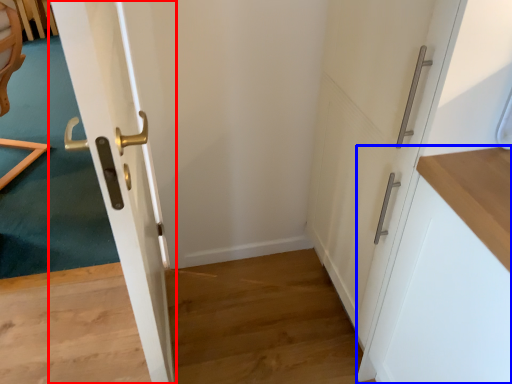
Question: Among these objects, which one is nearest to the camera, door (highlighted by a red box) or cabinetry (highlighted by a blue box)?

Choices:
 (A) door
 (B) cabinetry

Answer: (A)